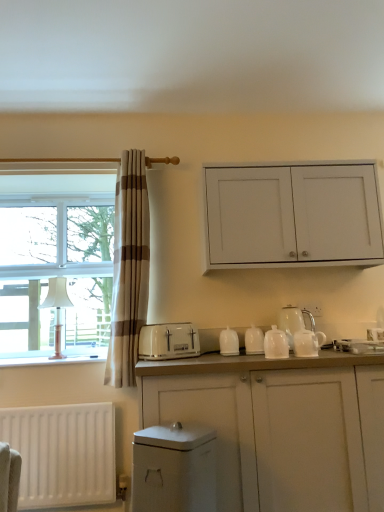
Find the location of `white glossy dishwasher at lower center`. white glossy dishwasher at lower center is located at coordinates (174, 469).

At what (x,y) coordinates should I click in order to perform the action: click on white plastic toaster at center. Please return your answer as a coordinate pair (x, y). The width and height of the screenshot is (384, 512). Looking at the image, I should click on (168, 341).

You are a GUI agent. You are given a task and a screenshot of the screen. Output one action in this format:
    pyautogui.click(x=<x>, y=<y>)
    Task: Click on the white glossy teapot at right, placed as the first tea pot when sorted from front to back
    
    Given the screenshot: What is the action you would take?
    pyautogui.click(x=308, y=339)

Find the location of a particular element. Image resolution: width=384 pixels, height=512 pixels. white glossy teapot at center, which ranks as the first tableware in back-to-front order is located at coordinates (254, 340).

The height and width of the screenshot is (512, 384). I want to click on white glossy teapot at center, the 3th tableware from the back, so click(276, 344).

Is white glossy teapot at center, the second tableware from the back, to the left of white glossy tea pot at right, which ranks as the first tea pot in back-to-front order, from the viewer's perspective?

Indeed, white glossy teapot at center, the second tableware from the back, is positioned on the left side of white glossy tea pot at right, which ranks as the first tea pot in back-to-front order.

Is white glossy teapot at center, the second tableware when ordered from front to back, in front of or behind white glossy tea pot at right, which ranks as the first tea pot in back-to-front order, in the image?

white glossy teapot at center, the second tableware when ordered from front to back, is in front of white glossy tea pot at right, which ranks as the first tea pot in back-to-front order.

The width and height of the screenshot is (384, 512). What are the coordinates of `the 2nd tea pot above the white glossy teapot at center, the second tableware from the back (from the image's perspective)` in the screenshot? It's located at (294, 321).

From the image's perspective, is white glossy teapot at center, the second tableware when ordered from front to back, located beneath white glossy tea pot at right, which ranks as the first tea pot in back-to-front order?

Yes, from the image's perspective, white glossy teapot at center, the second tableware when ordered from front to back, is beneath white glossy tea pot at right, which ranks as the first tea pot in back-to-front order.

Based on their sizes in the image, would you say white fabric lampshade at left is bigger or smaller than white matte cabinet at center, positioned as the first cabinetry in bottom-to-top order?

Considering their sizes, white fabric lampshade at left takes up less space than white matte cabinet at center, positioned as the first cabinetry in bottom-to-top order.

Identify the location of cabinetry that is the 2nd object located in front of the white fabric lampshade at left. The image size is (384, 512). (281, 426).

Which object is positioned more to the right, white fabric lampshade at left or white matte cabinet at center, positioned as the first cabinetry in bottom-to-top order?

white matte cabinet at center, positioned as the first cabinetry in bottom-to-top order.

In the scene shown: In terms of width, does white fabric lampshade at left look wider or thinner when compared to white matte cabinet at center, positioned as the first cabinetry in bottom-to-top order?

white fabric lampshade at left is thinner than white matte cabinet at center, positioned as the first cabinetry in bottom-to-top order.

What's the angular difference between white glossy teapot at center, the second tableware when ordered from front to back, and white matte radiator at lower left's facing directions?

0.0147 degrees separate the facing orientations of white glossy teapot at center, the second tableware when ordered from front to back, and white matte radiator at lower left.

Which is more to the left, white glossy teapot at center, the second tableware when ordered from front to back, or white matte radiator at lower left?

white matte radiator at lower left is more to the left.

Can we say white glossy teapot at center, the second tableware from the back, lies outside white matte radiator at lower left?

white glossy teapot at center, the second tableware from the back, lies outside white matte radiator at lower left's area.

Find the location of a particular element. This screenshot has width=384, height=512. the 2nd cabinetry to the left of the white glossy tea pot at right, the second tea pot when ordered from front to back, starting your count from the anchor is located at coordinates (281, 426).

Is white matte cabinet at center, positioned as the first cabinetry in bottom-to-top order, facing towards white glossy tea pot at right, the second tea pot when ordered from front to back?

No, white matte cabinet at center, positioned as the first cabinetry in bottom-to-top order, is not turned towards white glossy tea pot at right, the second tea pot when ordered from front to back.

Considering the sizes of objects white matte cabinet at center, positioned as the first cabinetry in bottom-to-top order, and white glossy tea pot at right, which ranks as the first tea pot in back-to-front order, in the image provided, who is wider, white matte cabinet at center, positioned as the first cabinetry in bottom-to-top order, or white glossy tea pot at right, which ranks as the first tea pot in back-to-front order,?

With larger width is white matte cabinet at center, positioned as the first cabinetry in bottom-to-top order.

Considering the points (294, 496) and (300, 328), which point is behind, point (294, 496) or point (300, 328)?

Positioned behind is point (300, 328).

From a real-world perspective, who is located lower, white fabric lampshade at left or white glossy tea pot at right, the second tea pot when ordered from front to back?

white glossy tea pot at right, the second tea pot when ordered from front to back, from a real-world perspective.

Which point is more distant from viewer, (58,305) or (294,332)?

Point (58,305)

How far apart are white fabric lampshade at left and white glossy tea pot at right, which ranks as the first tea pot in back-to-front order?

They are 5.13 feet apart.

In the scene shown: Is white fabric lampshade at left looking in the opposite direction of white glossy tea pot at right, the second tea pot when ordered from front to back?

white fabric lampshade at left does not have its back to white glossy tea pot at right, the second tea pot when ordered from front to back.

Considering the relative sizes of white matte radiator at lower left and white matte cabinet at upper right, the first cabinetry when ordered from top to bottom, in the image provided, is white matte radiator at lower left taller than white matte cabinet at upper right, the first cabinetry when ordered from top to bottom,?

Incorrect, the height of white matte radiator at lower left is not larger of that of white matte cabinet at upper right, the first cabinetry when ordered from top to bottom.

Looking at this image, is white matte radiator at lower left at the right side of white matte cabinet at upper right, which appears as the 2th cabinetry when ordered from the bottom?

No, white matte radiator at lower left is not to the right of white matte cabinet at upper right, which appears as the 2th cabinetry when ordered from the bottom.

From the image's perspective, would you say white matte radiator at lower left is shown under white matte cabinet at upper right, which appears as the 2th cabinetry when ordered from the bottom?

Correct, white matte radiator at lower left appears lower than white matte cabinet at upper right, which appears as the 2th cabinetry when ordered from the bottom, in the image.

Is white matte radiator at lower left turned away from white matte cabinet at upper right, the first cabinetry when ordered from top to bottom?

No, white matte cabinet at upper right, the first cabinetry when ordered from top to bottom, is not at the back of white matte radiator at lower left.

Considering the sizes of objects white plastic toaster at lower left and white matte radiator at lower left in the image provided, who is wider, white plastic toaster at lower left or white matte radiator at lower left?

Wider between the two is white plastic toaster at lower left.

Which of these two, white plastic toaster at lower left or white matte radiator at lower left, is smaller?

white plastic toaster at lower left is smaller.

From a real-world perspective, is white plastic toaster at lower left located beneath white matte radiator at lower left?

No, from a real-world perspective, white plastic toaster at lower left is not under white matte radiator at lower left.

In order to click on tableware that is the 3rd one when counting downward from the white glossy tea pot at right, the second tea pot when ordered from front to back (from the image's perspective) in this screenshot , I will do `click(229, 342)`.

The image size is (384, 512). Find the location of `the 2nd cabinetry in front when counting from the white fabric lampshade at left`. the 2nd cabinetry in front when counting from the white fabric lampshade at left is located at coordinates (281, 426).

Which object lies nearer to the anchor point white plastic toaster at lower left, white matte cabinet at upper right, which appears as the 2th cabinetry when ordered from the bottom, or white glossy teapot at center, which ranks as the first tableware in back-to-front order?

The object closer to white plastic toaster at lower left is white glossy teapot at center, which ranks as the first tableware in back-to-front order.

When comparing their distances from white glossy tea pot at right, which ranks as the first tea pot in back-to-front order, does white glossy teapot at center, the second tableware from the back, or white matte cabinet at upper right, the first cabinetry when ordered from top to bottom, seem further?

The object further to white glossy tea pot at right, which ranks as the first tea pot in back-to-front order, is white matte cabinet at upper right, the first cabinetry when ordered from top to bottom.

Looking at the image, which one is located closer to white matte cabinet at upper right, which appears as the 2th cabinetry when ordered from the bottom, white glossy teapot at center, which appears as the first tableware when viewed from the front, or white matte radiator at lower left?

white glossy teapot at center, which appears as the first tableware when viewed from the front.

When comparing their distances from white glossy teapot at right, the 2th tea pot when ordered from back to front, does white fabric lampshade at left or white glossy teapot at center, which ranks as the first tableware in back-to-front order, seem closer?

white glossy teapot at center, which ranks as the first tableware in back-to-front order, lies closer to white glossy teapot at right, the 2th tea pot when ordered from back to front, than the other object.

Considering their positions, is white matte radiator at lower left positioned closer to white matte cabinet at upper right, the first cabinetry when ordered from top to bottom, than white glossy dishwasher at lower center?

The object closer to white matte cabinet at upper right, the first cabinetry when ordered from top to bottom, is white glossy dishwasher at lower center.

Considering their positions, is white fabric lampshade at left positioned closer to white glossy tea pot at right, which ranks as the first tea pot in back-to-front order, than white matte radiator at lower left?

Based on the image, white matte radiator at lower left appears to be nearer to white glossy tea pot at right, which ranks as the first tea pot in back-to-front order.

Considering their positions, is white matte radiator at lower left positioned further to white glossy tea pot at right, the second tea pot when ordered from front to back, than white matte cabinet at upper right, which appears as the 2th cabinetry when ordered from the bottom?

white matte radiator at lower left lies further to white glossy tea pot at right, the second tea pot when ordered from front to back, than the other object.

Based on their spatial positions, is beige striped curtain at left or white matte radiator at lower left further from white glossy teapot at center, the second tableware from the back?

Based on the image, white matte radiator at lower left appears to be further to white glossy teapot at center, the second tableware from the back.

This screenshot has height=512, width=384. I want to click on kitchen appliance between white glossy dishwasher at lower center and white glossy teapot at center, the second tableware when ordered from front to back, in the front-back direction, so click(x=168, y=341).

This screenshot has height=512, width=384. What are the coordinates of `kitchen appliance between beige striped curtain at left and white matte cabinet at upper right, which appears as the 2th cabinetry when ordered from the bottom, from left to right` in the screenshot? It's located at (168, 341).

Where is `curtain situated between white matte radiator at lower left and white glossy teapot at right, the 2th tea pot when ordered from back to front, from left to right`? curtain situated between white matte radiator at lower left and white glossy teapot at right, the 2th tea pot when ordered from back to front, from left to right is located at coordinates (129, 269).

Where is `kitchen appliance located between beige striped curtain at left and white glossy teapot at center, the second tableware when ordered from front to back, in the left-right direction`? kitchen appliance located between beige striped curtain at left and white glossy teapot at center, the second tableware when ordered from front to back, in the left-right direction is located at coordinates (168, 341).